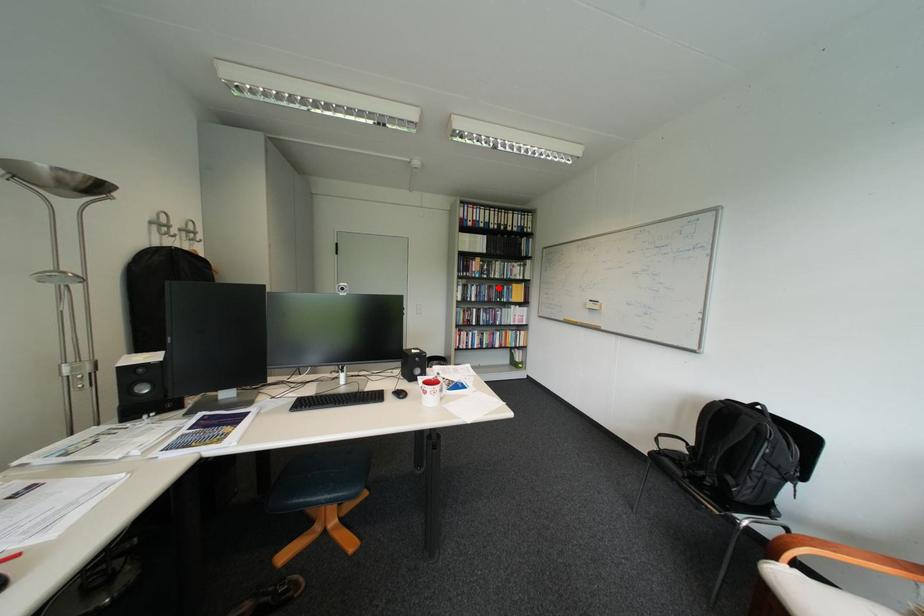
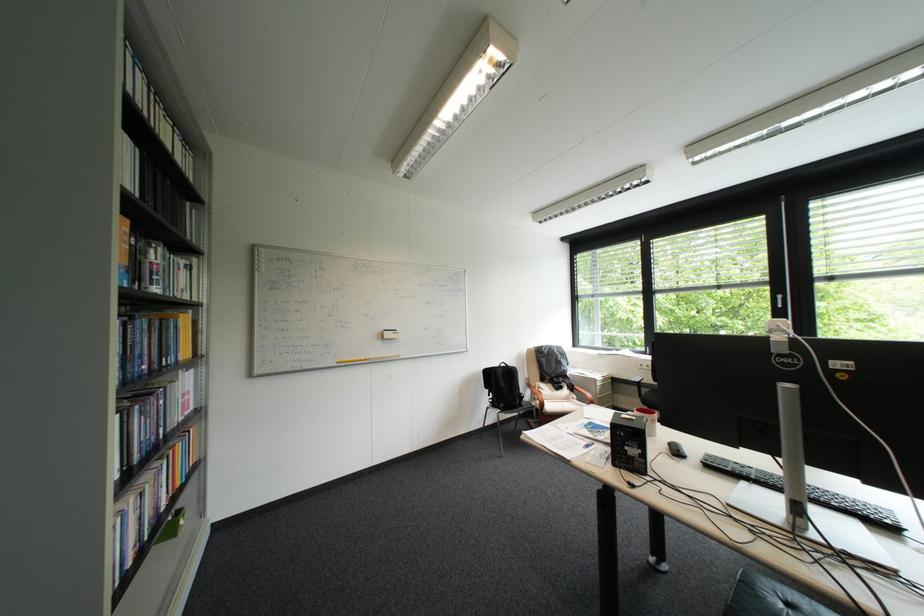
Locate, in the second image, the point that corresponds to the highlighted location in the first image.

(159, 326)